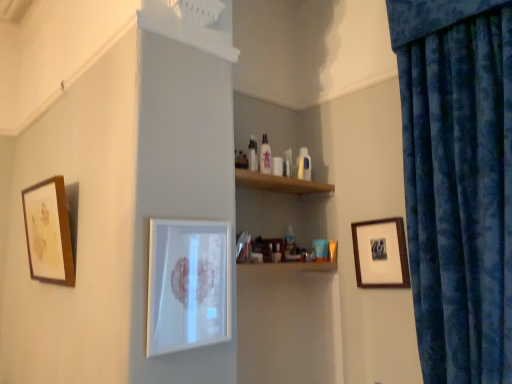
Question: From the image's perspective, is wooden framed artwork at left, the first picture frame from the left, over wooden framed print at right, which is the 1th picture frame in right-to-left order?

Choices:
 (A) no
 (B) yes

Answer: (B)

Question: Could you tell me if wooden framed artwork at left, positioned as the 3th picture frame in right-to-left order, is facing wooden framed print at right, which is the 1th picture frame in right-to-left order?

Choices:
 (A) yes
 (B) no

Answer: (B)

Question: Can you confirm if wooden framed artwork at left, positioned as the 3th picture frame in right-to-left order, is smaller than wooden framed print at right, which is the 1th picture frame in right-to-left order?

Choices:
 (A) no
 (B) yes

Answer: (A)

Question: Can you confirm if wooden framed artwork at left, positioned as the 3th picture frame in right-to-left order, is shorter than wooden framed print at right, the third picture frame in the left-to-right sequence?

Choices:
 (A) no
 (B) yes

Answer: (A)

Question: Can you confirm if wooden framed artwork at left, the first picture frame from the left, is positioned to the right of wooden framed print at right, which is the 1th picture frame in right-to-left order?

Choices:
 (A) no
 (B) yes

Answer: (A)

Question: Is wooden framed print at right, which is the 1th picture frame in right-to-left order, inside or outside of white glossy picture frame at center, the 2th picture frame from the left?

Choices:
 (A) outside
 (B) inside

Answer: (A)

Question: In terms of height, does wooden framed print at right, the third picture frame in the left-to-right sequence, look taller or shorter compared to white glossy picture frame at center, the 2th picture frame from the left?

Choices:
 (A) tall
 (B) short

Answer: (B)

Question: Is point (389, 259) positioned closer to the camera than point (193, 231)?

Choices:
 (A) closer
 (B) farther

Answer: (B)

Question: From the image's perspective, is wooden framed print at right, the third picture frame in the left-to-right sequence, located above or below white glossy picture frame at center, the 2th picture frame from the left?

Choices:
 (A) below
 (B) above

Answer: (B)

Question: Does point (373, 248) appear closer or farther from the camera than point (407, 99)?

Choices:
 (A) farther
 (B) closer

Answer: (A)

Question: Is wooden framed print at right, which is the 1th picture frame in right-to-left order, wider or thinner than velvety blue curtain at right?

Choices:
 (A) thin
 (B) wide

Answer: (A)

Question: Is wooden framed print at right, the third picture frame in the left-to-right sequence, in front of or behind velvety blue curtain at right in the image?

Choices:
 (A) front
 (B) behind

Answer: (B)

Question: In the image, is wooden framed print at right, which is the 1th picture frame in right-to-left order, on the left side or the right side of velvety blue curtain at right?

Choices:
 (A) left
 (B) right

Answer: (A)

Question: Is velvety blue curtain at right taller or shorter than white glossy picture frame at center, placed as the 2th picture frame when sorted from right to left?

Choices:
 (A) tall
 (B) short

Answer: (A)

Question: From a real-world perspective, is velvety blue curtain at right above or below white glossy picture frame at center, the 2th picture frame from the left?

Choices:
 (A) below
 (B) above

Answer: (B)